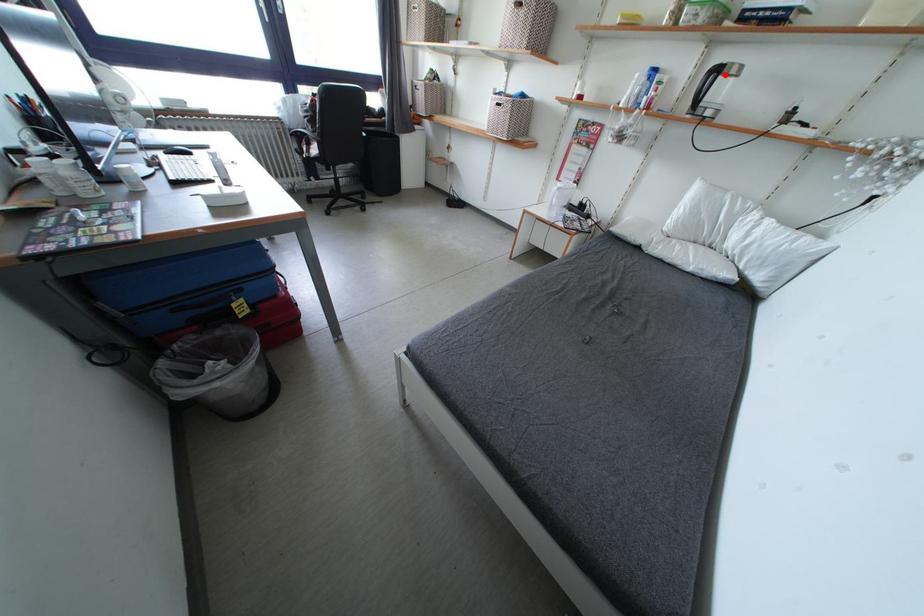
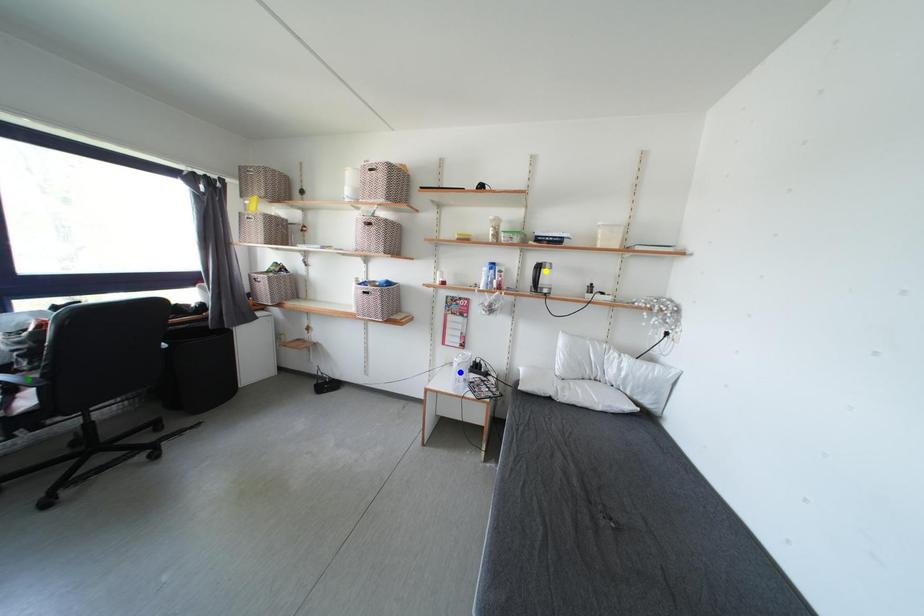
Question: I am providing you with two images of the same scene from different viewpoints. A red point is marked on the first image. You are given multiple points on the second image. Which mark in image 2 goes with the point in image 1?

Choices:
 (A) blue point
 (B) green point
 (C) yellow point

Answer: (C)